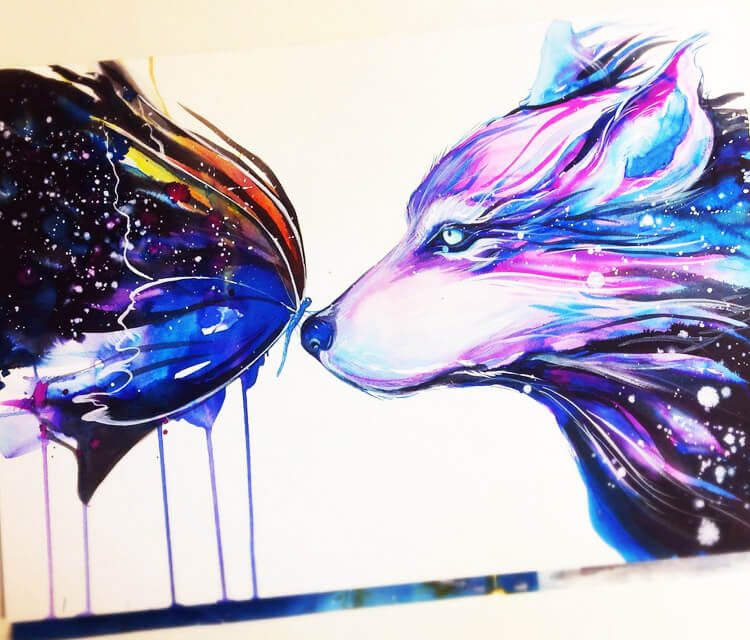
The image size is (750, 640). Find the location of `paint`. paint is located at coordinates (166, 506), (46, 541), (250, 483).